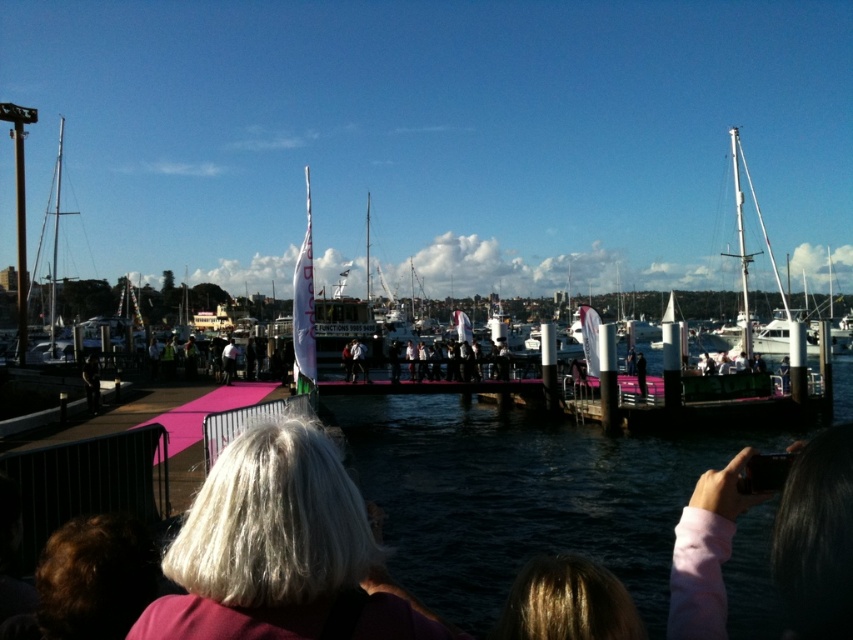
Question: Which object is closer to the camera taking this photo?

Choices:
 (A) white glossy sailboat at right
 (B) pink fabric at lower right

Answer: (B)

Question: Can you confirm if blonde hair at center is positioned to the right of pink fabric at lower right?

Choices:
 (A) yes
 (B) no

Answer: (B)

Question: Is blonde hair at center to the left of pink fabric at lower right from the viewer's perspective?

Choices:
 (A) yes
 (B) no

Answer: (A)

Question: Does white glossy sailboat at right have a larger size compared to dark gray fabric jacket at lower left?

Choices:
 (A) no
 (B) yes

Answer: (B)

Question: Considering the real-world distances, which object is farthest from the blonde hair at center?

Choices:
 (A) white glossy sailboat at right
 (B) dark gray fabric jacket at lower left
 (C) pink fabric at lower right

Answer: (A)

Question: Estimate the real-world distances between objects in this image. Which object is closer to the white glossy sailboat at right?

Choices:
 (A) pink fabric at lower right
 (B) dark gray fabric jacket at lower left

Answer: (A)